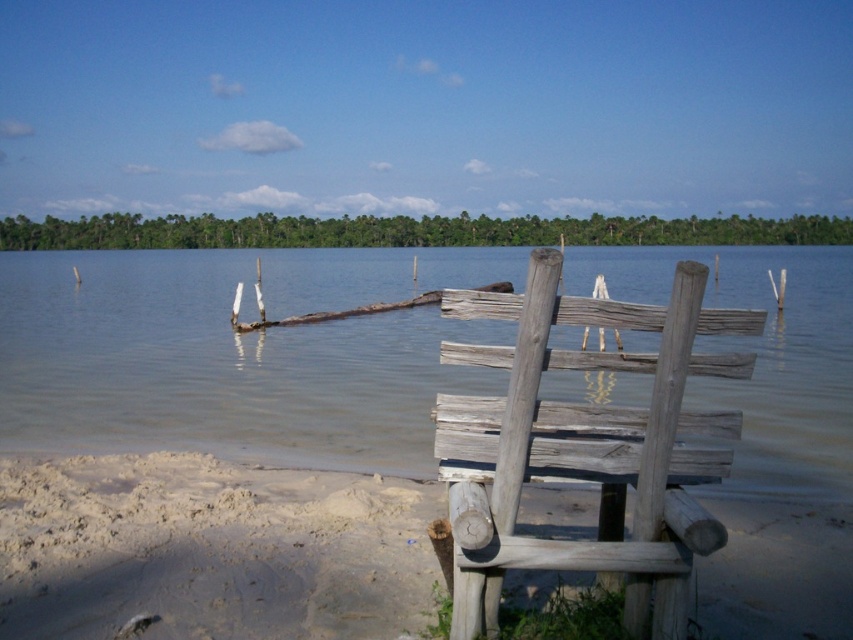
You are standing on the light brown sandy beach at lower left and want to reach the clear water at chair right. Based on the scene description, which direction should you move to get to the water?

You should move towards the clear water at chair right because it has a greater height compared to the light brown sandy beach at lower left, meaning it is higher ground and you would naturally move upwards towards it.

You are standing at the center of the wooden structure in the middle ground. Looking towards the point labeled as point (210,548), which object would you see first?

The light brown sandy beach at lower left is located at point (210,548), so you would see it first when looking in that direction.